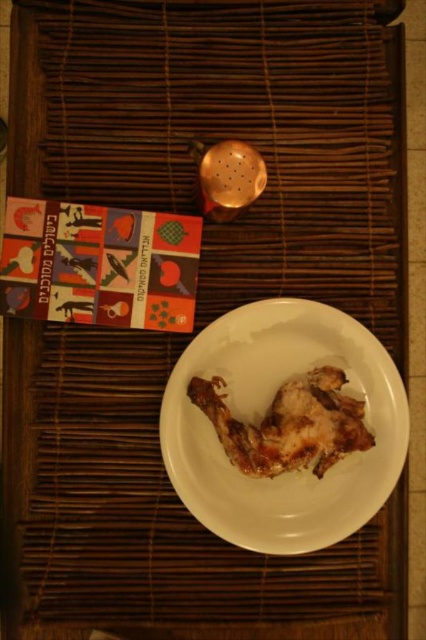
Is point (180, 444) less distant than point (284, 400)?

Yes, it is.

Between point (227, 509) and point (296, 384), which one is positioned in front?

Point (227, 509) is more forward.

Between point (169, 460) and point (359, 428), which one is positioned in front?

Positioned in front is point (169, 460).

Locate an element on the screen. This screenshot has height=640, width=426. white glossy plate at center is located at coordinates point(262,417).